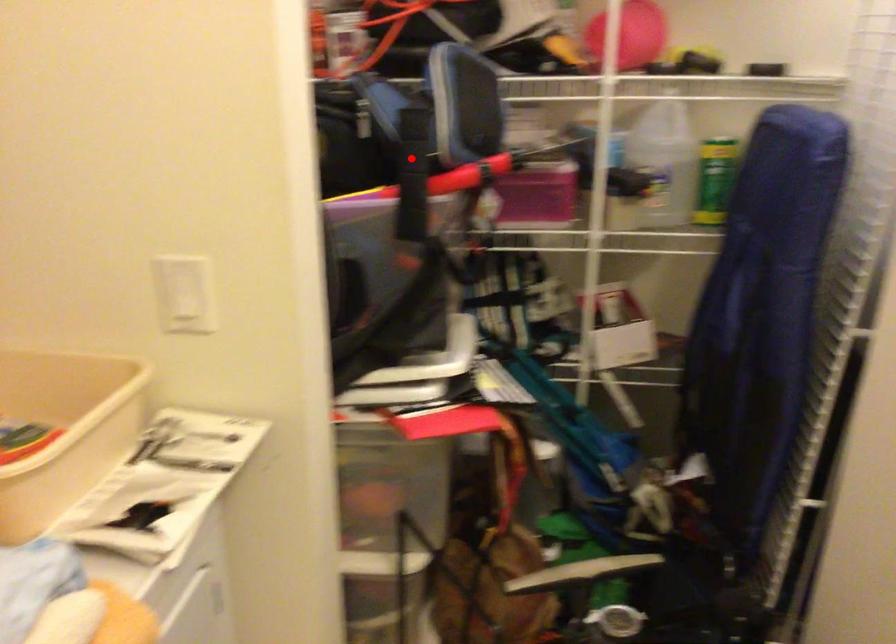
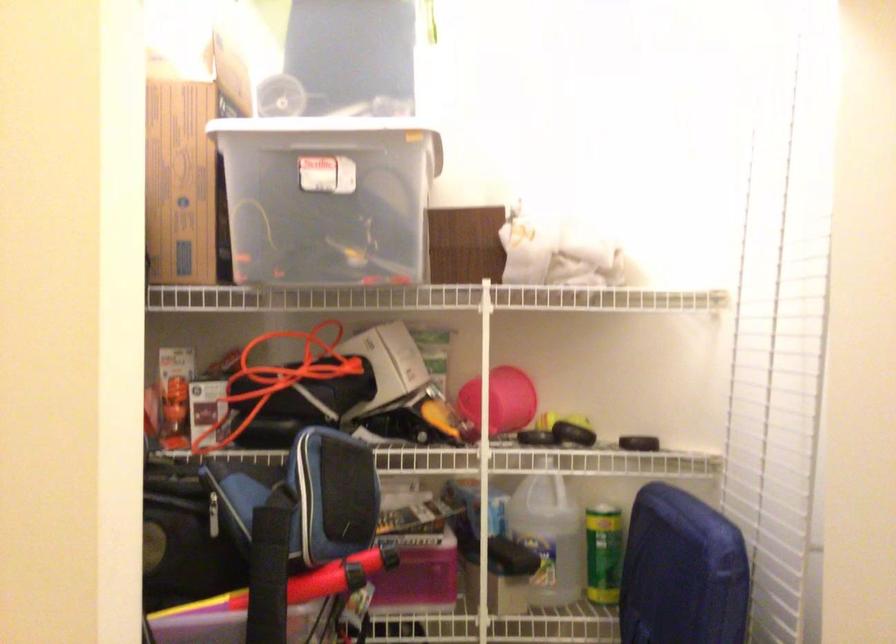
The point at the highlighted location is marked in the first image. Where is the corresponding point in the second image?

(269, 574)